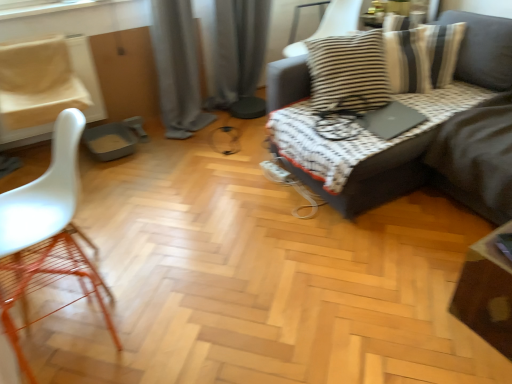
At what (x,y) coordinates should I click in order to perform the action: click on empty space that is to the right of white matte chair at left, acting as the first chair starting from the bottom. Please return your answer as a coordinate pair (x, y). The width and height of the screenshot is (512, 384). Looking at the image, I should click on (164, 284).